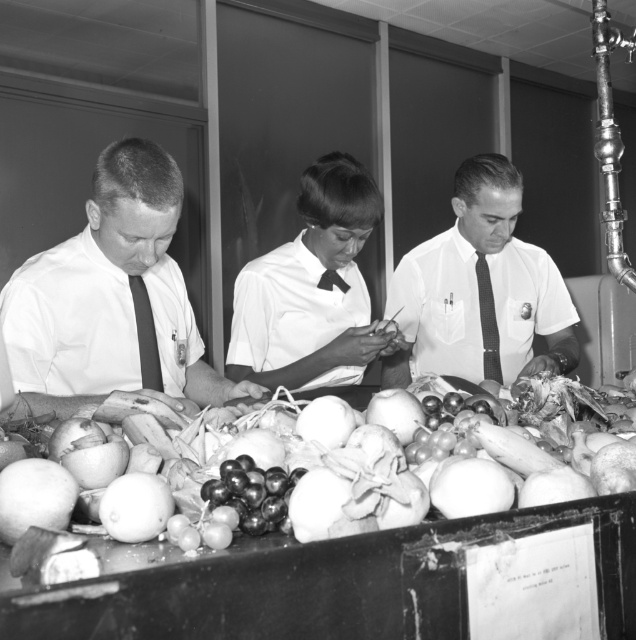
Question: Can you confirm if white shirt at center is positioned below black silk tie at left?

Choices:
 (A) yes
 (B) no

Answer: (B)

Question: Which object is farther from the camera taking this photo?

Choices:
 (A) black silk tie at left
 (B) glossy purple grapes at center
 (C) smooth white onion at center

Answer: (A)

Question: Observing the image, what is the correct spatial positioning of matte white shirt at left in reference to black silk tie at center?

Choices:
 (A) left
 (B) right

Answer: (A)

Question: Which of these objects is positioned closest to the smooth white onion at center?

Choices:
 (A) black checkered tie at center
 (B) smooth white shirt at center
 (C) matte white shirt at left
 (D) glossy purple grapes at center

Answer: (D)

Question: Among these objects, which one is nearest to the camera?

Choices:
 (A) black silk tie at left
 (B) white shirt at center
 (C) smooth white onion at center
 (D) glossy purple grapes at center

Answer: (C)

Question: Can you confirm if matte white shirt at left is bigger than black silk tie at left?

Choices:
 (A) no
 (B) yes

Answer: (B)